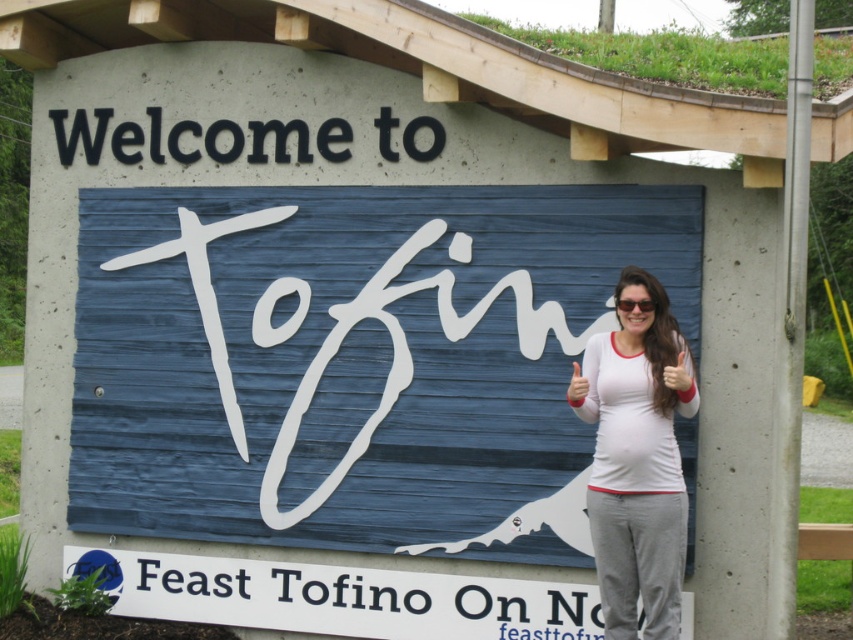
Based on the scene description, which plastic sign is taller, the white plastic sign at lower center or the black plastic sign at upper center?

The white plastic sign at lower center is taller than the black plastic sign at upper center according to the description.

You are a tourist looking at the welcome sign and the person next to it. Which object is positioned to the left of the other between the black plastic sign at upper center and the matte white sunglasses at center?

The black plastic sign at upper center is to the left of the matte white sunglasses at center.

You are standing in front of the Tofino welcome sign. There is a black plastic sign at upper center and a matte white sunglasses at center. How far apart are these two items?

The black plastic sign at upper center is 6.27 feet away from matte white sunglasses at center.